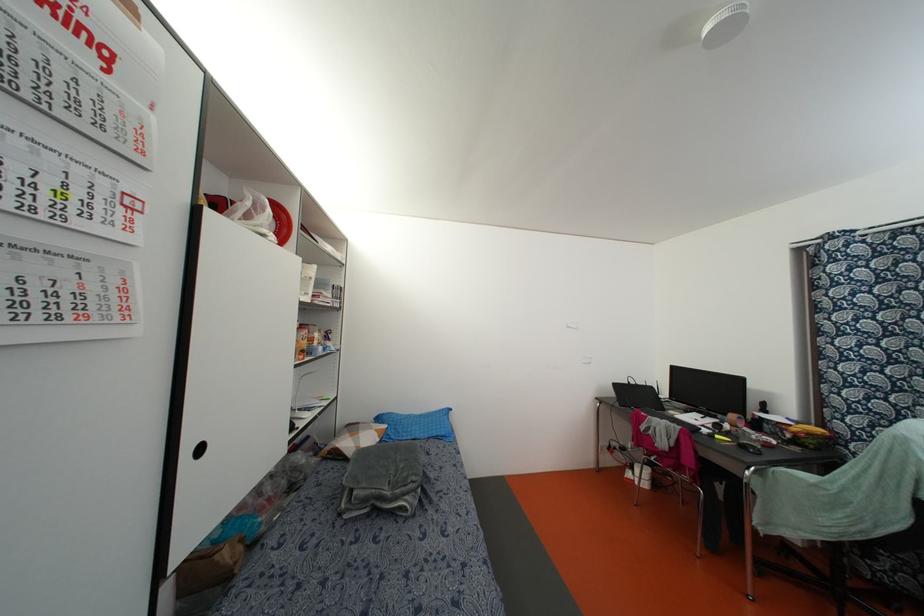
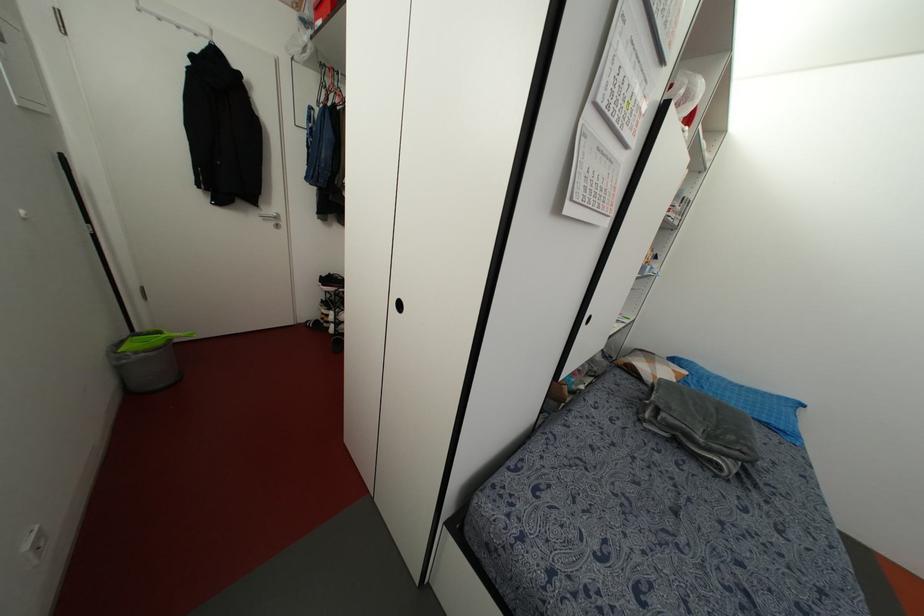
Find the pixel in the second image that matches (442,434) in the first image.

(782, 427)